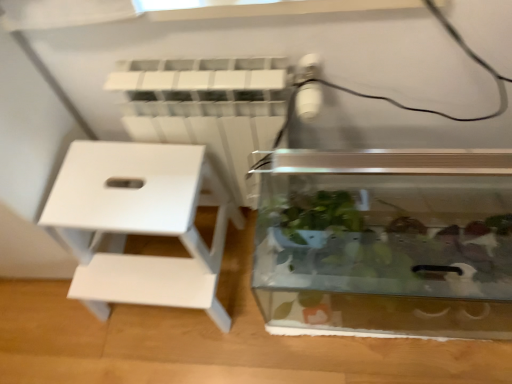
Identify the location of vacant space that is to the left of white matte stool at left. The width and height of the screenshot is (512, 384). (64, 333).